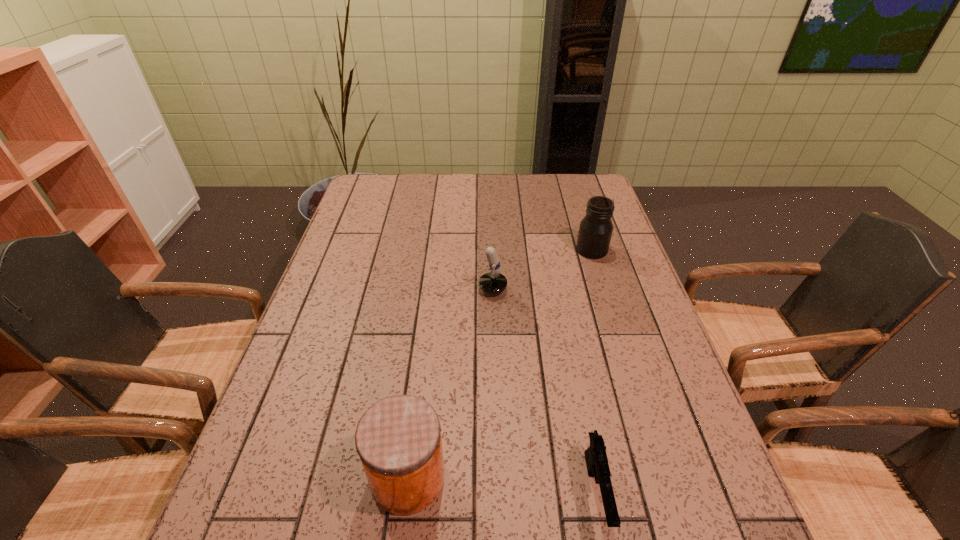
Locate an element on the screen. This screenshot has width=960, height=540. free space that is in between the farthest object and the microphone is located at coordinates (532, 269).

Identify the location of object that is the closest to the nearer jar. (596, 458).

Identify the location of object that stands as the closest to the second shortest object. (596, 228).